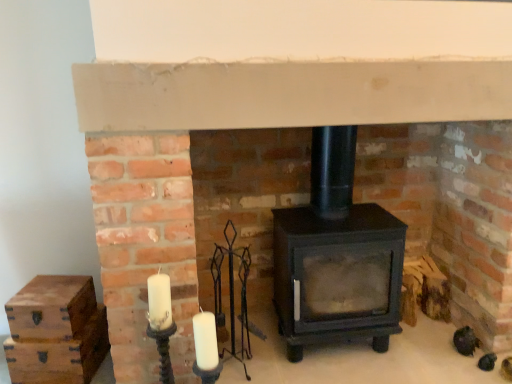
Question: Is wooden chest at lower left, which appears as the first drawer when ordered from the bottom, wider or thinner than wooden chest at left, the second drawer when ordered from bottom to top?

Choices:
 (A) thin
 (B) wide

Answer: (A)

Question: In the image, is wooden chest at lower left, which appears as the first drawer when ordered from the bottom, positioned in front of or behind wooden chest at left, arranged as the 1th drawer when viewed from the top?

Choices:
 (A) front
 (B) behind

Answer: (B)

Question: Estimate the real-world distances between objects in this image. Which object is farther from the wooden chest at lower left, the 2th drawer from the top?

Choices:
 (A) matte black wood burning stove at center
 (B) wooden chest at left, the second drawer when ordered from bottom to top

Answer: (A)

Question: Which is nearer to the wooden chest at left, arranged as the 1th drawer when viewed from the top?

Choices:
 (A) wooden chest at lower left, the 2th drawer from the top
 (B) matte black wood burning stove at center

Answer: (A)